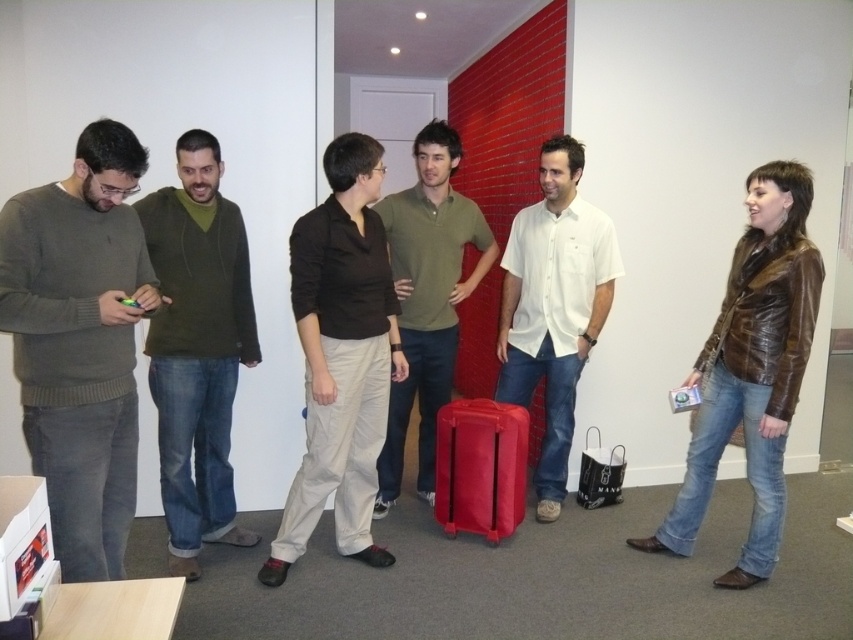
You are organizing a photo shoot and need to position two props. The matte gray sweater at left and the brown leather jacket at right are already placed. Based on their current positions, which prop is positioned more to the east?

The matte gray sweater at left is positioned more to the east because it is to the left of the brown leather jacket at right, and in the image, left typically corresponds to the east direction.

You are a delivery person trying to place a small package between the matte brown shirt at center and the white cotton shirt at center. Can you fit it there?

The distance between the matte brown shirt at center and the white cotton shirt at center is 33.12 inches, so the package can easily be placed there as the space is sufficient.

You are a photographer standing in front of the group and want to take a photo of the matte brown shirt at center and the matte green polo shirt at center. The camera you are using has a minimum focus distance of 18 inches. Will you be able to capture both subjects clearly in the photo?

The matte brown shirt at center and matte green polo shirt at center are 17.56 inches apart. Since the minimum focus distance is 18 inches, the camera cannot focus on both subjects clearly as they are closer than the required distance.